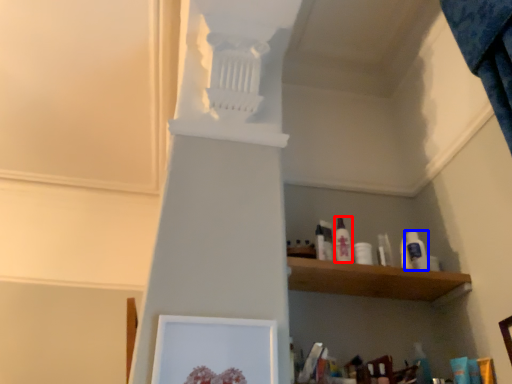
Question: Which object appears farthest to the camera in this image, toiletry (highlighted by a red box) or toiletry (highlighted by a blue box)?

Choices:
 (A) toiletry
 (B) toiletry

Answer: (B)